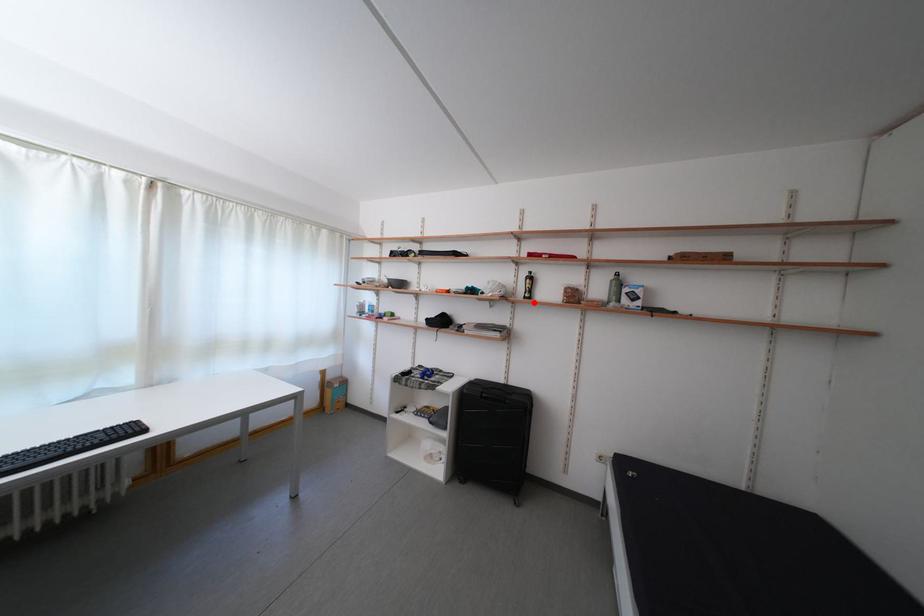
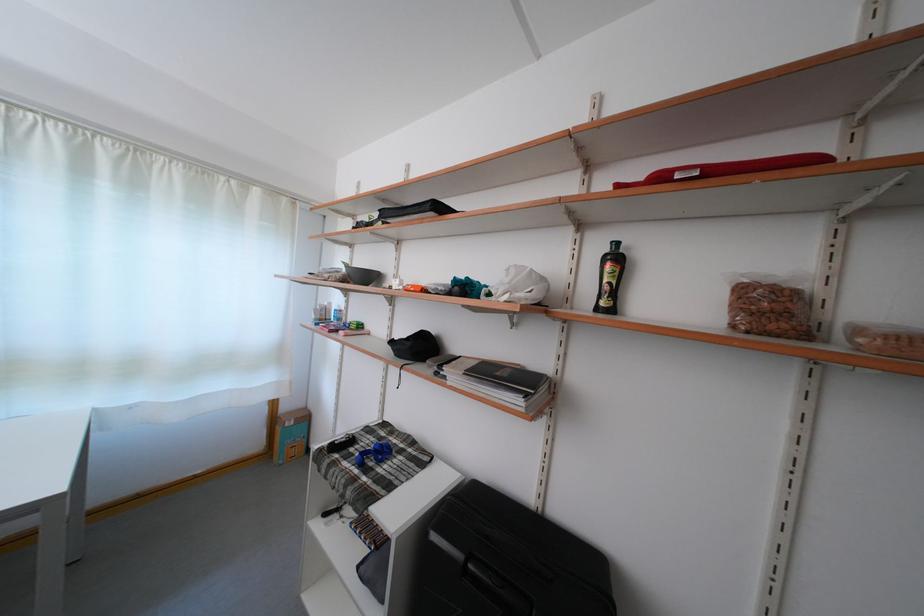
Question: I am providing you with two images of the same scene from different viewpoints. A red point is marked on the first image. Can you still see the location of the red point in image 2?

Choices:
 (A) Yes
 (B) No

Answer: (A)